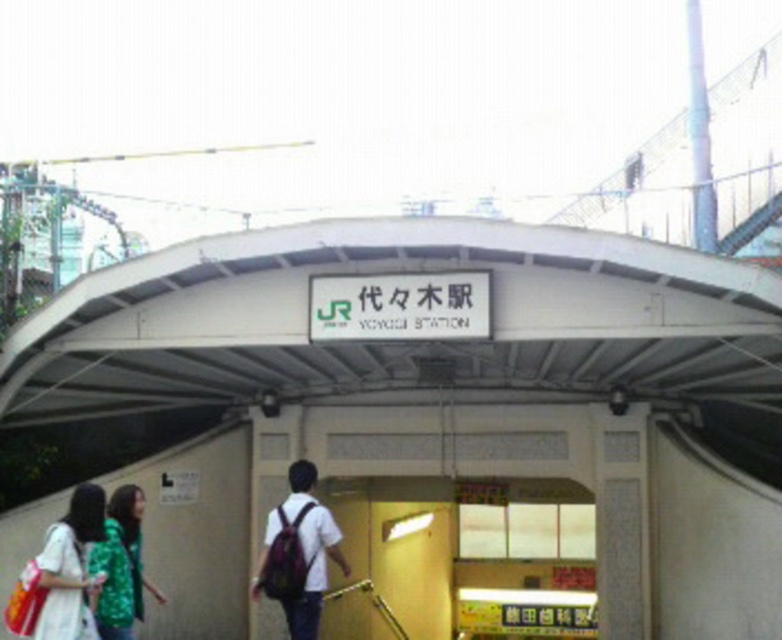
Consider the image. You are standing at the entrance of Yoyogi Station and see a white matte overpass at center and a matte white shirt with backpack at center. Which object is taller?

The white matte overpass at center is much taller than the matte white shirt with backpack at center.

You are standing at the entrance of Yoyogi Station. There is a point marked at coordinate (70, 566). What object is located at that point?

The point at coordinate (70, 566) is on the white cotton dress at lower left.